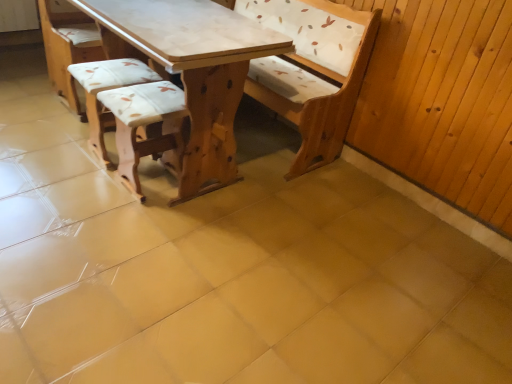
You are a GUI agent. You are given a task and a screenshot of the screen. Output one action in this format:
    pyautogui.click(x=<x>, y=<y>)
    Task: Click on the vacant area in front of white fabric cushion at center, positioned as the 2th armchair in right-to-left order
    
    Given the screenshot: What is the action you would take?
    pyautogui.click(x=77, y=182)